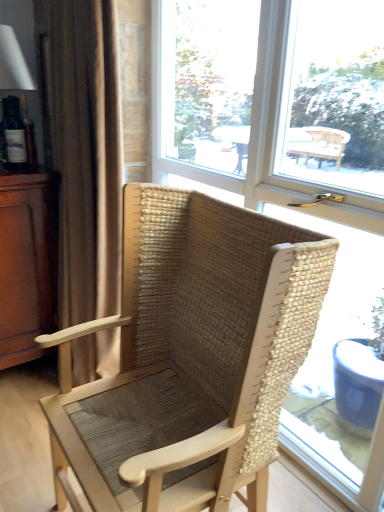
Question: Is the position of transparent glass window at center less distant than that of brown wood dresser at left?

Choices:
 (A) yes
 (B) no

Answer: (A)

Question: Is transparent glass window at center oriented towards brown wood dresser at left?

Choices:
 (A) yes
 (B) no

Answer: (A)

Question: Is transparent glass window at center thinner than brown wood dresser at left?

Choices:
 (A) no
 (B) yes

Answer: (B)

Question: From a real-world perspective, is transparent glass window at center located higher than brown wood dresser at left?

Choices:
 (A) yes
 (B) no

Answer: (A)

Question: Is transparent glass window at center oriented away from brown wood dresser at left?

Choices:
 (A) no
 (B) yes

Answer: (A)

Question: Is the surface of transparent glass window at center in direct contact with brown wood dresser at left?

Choices:
 (A) yes
 (B) no

Answer: (B)

Question: Could natural woven wood chair at center be considered to be inside transparent glass window at center?

Choices:
 (A) yes
 (B) no

Answer: (B)

Question: Is transparent glass window at center turned away from natural woven wood chair at center?

Choices:
 (A) no
 (B) yes

Answer: (B)

Question: Can you confirm if transparent glass window at center is taller than natural woven wood chair at center?

Choices:
 (A) no
 (B) yes

Answer: (B)

Question: From a real-world perspective, does transparent glass window at center sit lower than natural woven wood chair at center?

Choices:
 (A) yes
 (B) no

Answer: (B)

Question: From the image's perspective, is transparent glass window at center located above natural woven wood chair at center?

Choices:
 (A) no
 (B) yes

Answer: (B)

Question: Could you tell me if transparent glass window at center is turned towards natural woven wood chair at center?

Choices:
 (A) no
 (B) yes

Answer: (B)

Question: Is the depth of brown fabric curtain at left less than that of transparent glass window at center?

Choices:
 (A) yes
 (B) no

Answer: (B)